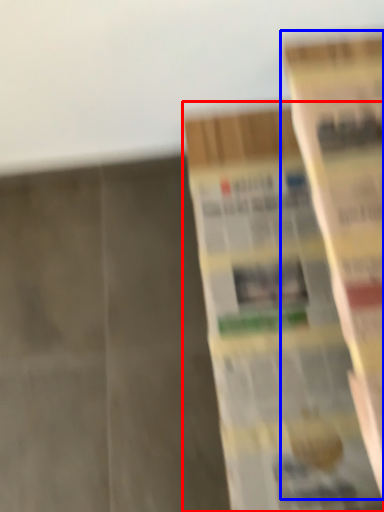
Question: Which of the following is the closest to the observer, book (highlighted by a red box) or book (highlighted by a blue box)?

Choices:
 (A) book
 (B) book

Answer: (B)